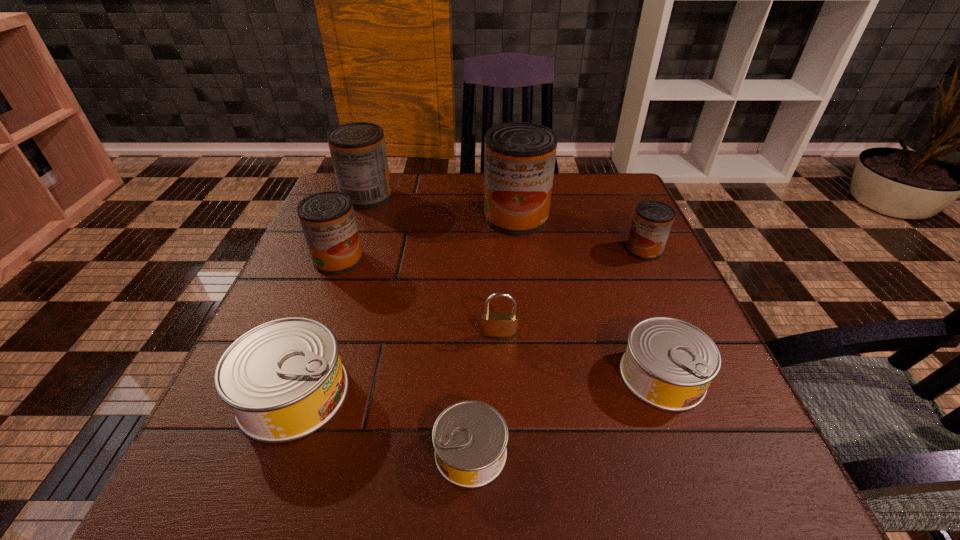
Where is `the second smallest silver can`? The image size is (960, 540). the second smallest silver can is located at coordinates (669, 363).

This screenshot has height=540, width=960. Identify the location of the sixth tallest can. (669, 363).

Locate an element on the screen. This screenshot has width=960, height=540. the shortest can is located at coordinates (470, 438).

At what (x,y) coordinates should I click in order to perform the action: click on the smallest silver can. Please return your answer as a coordinate pair (x, y). Looking at the image, I should click on (470, 438).

Locate an element on the screen. This screenshot has width=960, height=540. vacant space located on the right of the tallest can is located at coordinates (572, 217).

Identify the location of vacant region located on the front of the second biggest red can. (350, 241).

I want to click on free point located 0.220m on the back of the second smallest red can, so click(363, 197).

Where is `vacant space positioned on the front-facing side of the brass padlock`? The height and width of the screenshot is (540, 960). vacant space positioned on the front-facing side of the brass padlock is located at coordinates (507, 511).

Where is `vacant space located on the front of the rightmost red can`? The width and height of the screenshot is (960, 540). vacant space located on the front of the rightmost red can is located at coordinates (697, 364).

The width and height of the screenshot is (960, 540). What are the coordinates of `free space located on the back of the biggest silver can` in the screenshot? It's located at (356, 226).